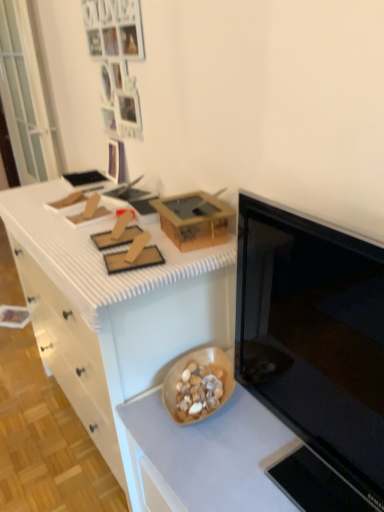
Question: Does black glossy microwave at right appear on the right side of transparent glass door at left?

Choices:
 (A) no
 (B) yes

Answer: (B)

Question: From a real-world perspective, is black glossy microwave at right on top of transparent glass door at left?

Choices:
 (A) no
 (B) yes

Answer: (A)

Question: Can you confirm if black glossy microwave at right is wider than transparent glass door at left?

Choices:
 (A) yes
 (B) no

Answer: (A)

Question: Considering the relative sizes of black glossy microwave at right and transparent glass door at left in the image provided, is black glossy microwave at right bigger than transparent glass door at left?

Choices:
 (A) yes
 (B) no

Answer: (B)

Question: From a real-world perspective, is black glossy microwave at right under transparent glass door at left?

Choices:
 (A) yes
 (B) no

Answer: (A)

Question: Is black glossy microwave at right next to transparent glass door at left?

Choices:
 (A) no
 (B) yes

Answer: (A)

Question: Is wooden bowl at lower center wider than white matte drawer at left?

Choices:
 (A) yes
 (B) no

Answer: (B)

Question: From a real-world perspective, is wooden bowl at lower center under white matte drawer at left?

Choices:
 (A) no
 (B) yes

Answer: (A)

Question: Does wooden bowl at lower center have a greater height compared to white matte drawer at left?

Choices:
 (A) no
 (B) yes

Answer: (B)

Question: Does wooden bowl at lower center have a lesser height compared to white matte drawer at left?

Choices:
 (A) yes
 (B) no

Answer: (B)

Question: From the image's perspective, is wooden bowl at lower center below white matte drawer at left?

Choices:
 (A) yes
 (B) no

Answer: (B)

Question: Is wooden bowl at lower center far away from white matte drawer at left?

Choices:
 (A) yes
 (B) no

Answer: (B)

Question: Is wooden bowl at lower center, which is the 2th countertop from top to bottom, facing away from wooden bowl at lower center?

Choices:
 (A) no
 (B) yes

Answer: (A)